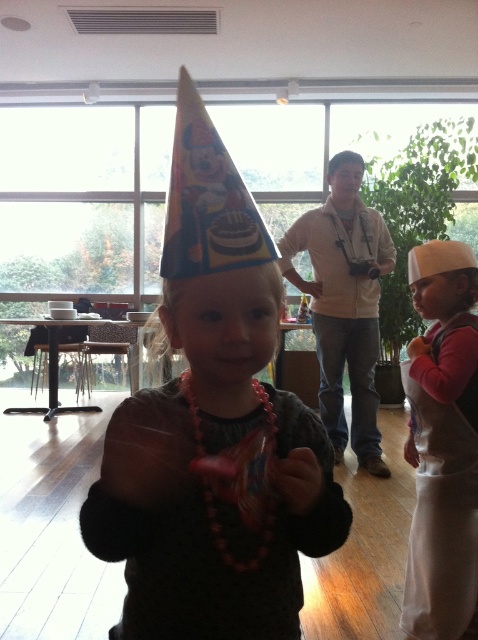
You are organizing a birthday party and need to decide where to place decorations. The matte party hat at center and the white fabric apron at lower right are both on the table. Which object takes up more space on the table?

The white fabric apron at lower right takes up more space on the table because the matte party hat at center occupies less space than it.

You are planning to place a decorative ribbon on the wider object between the matte party hat at center and the white fabric apron at lower right. Which object should you choose?

The matte party hat at center might be wider than the white fabric apron at lower right, so you should choose the matte party hat at center to place the decorative ribbon.